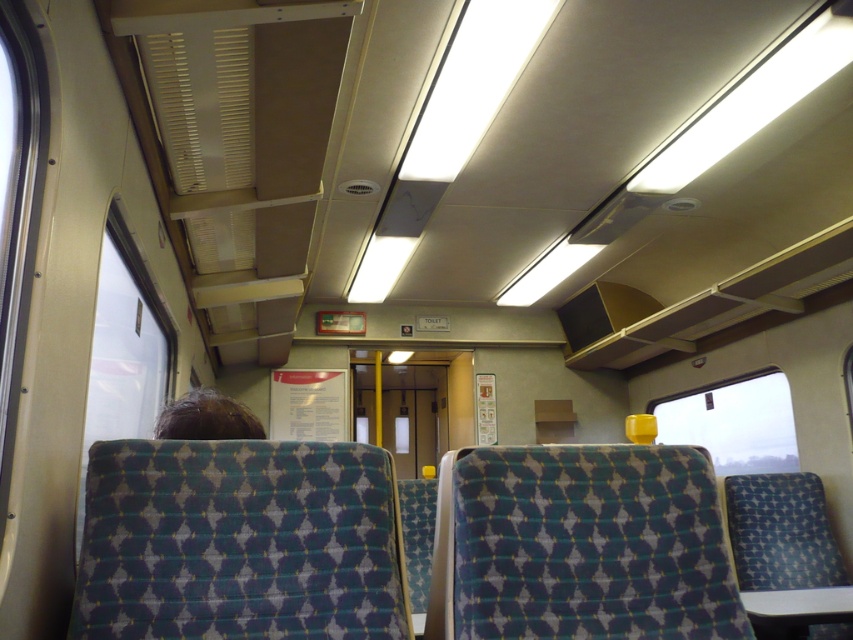
Question: Can you confirm if transparent glass window at left is thinner than transparent yellow cup at right?

Choices:
 (A) no
 (B) yes

Answer: (B)

Question: Which of the following is the closest to the observer?

Choices:
 (A) (776, 406)
 (B) (85, 419)

Answer: (B)

Question: Is transparent glass window at left smaller than transparent yellow cup at right?

Choices:
 (A) no
 (B) yes

Answer: (A)

Question: Can you confirm if transparent glass window at left is smaller than transparent yellow cup at right?

Choices:
 (A) no
 (B) yes

Answer: (A)